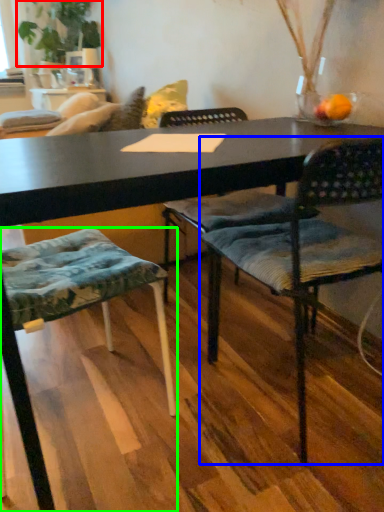
Question: Which object is the farthest from plant (highlighted by a red box)? Choose among these: chair (highlighted by a blue box) or chair (highlighted by a green box).

Choices:
 (A) chair
 (B) chair

Answer: (A)